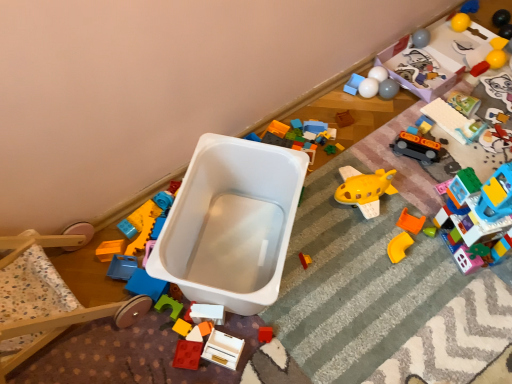
Where is `free point to the right of white plastic baby carriage at center`? free point to the right of white plastic baby carriage at center is located at coordinates click(353, 265).